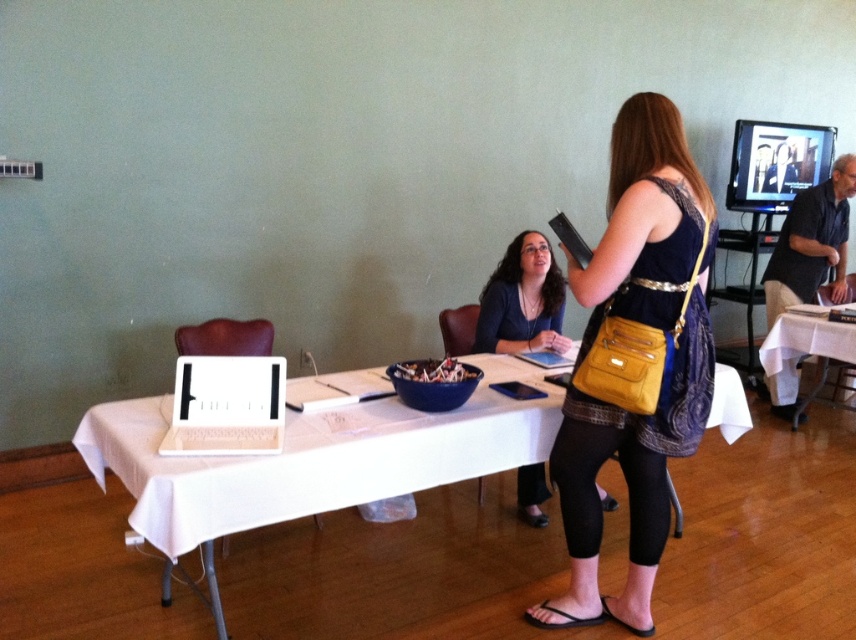
Is matte black shirt at center bigger than white cloth-covered table at right?

Actually, matte black shirt at center might be smaller than white cloth-covered table at right.

Does point (527, 477) come closer to viewer compared to point (848, 348)?

Yes, it is in front of point (848, 348).

Where is `matte black shirt at center`? This screenshot has width=856, height=640. matte black shirt at center is located at coordinates [522, 300].

Who is taller, matte black dress at center or matte black shirt at center?

With more height is matte black dress at center.

Does point (673, 317) lie in front of point (528, 481)?

Yes, point (673, 317) is in front of point (528, 481).

Does point (676, 452) come behind point (519, 492)?

No, it is in front of (519, 492).

Identify the location of matte black dress at center. (639, 360).

Does matte black dress at center have a greater height compared to white cloth-covered table at right?

Correct, matte black dress at center is much taller as white cloth-covered table at right.

Can you confirm if matte black dress at center is shorter than white cloth-covered table at right?

Incorrect, matte black dress at center's height does not fall short of white cloth-covered table at right's.

Find the location of a particular element. The image size is (856, 640). matte black dress at center is located at coordinates (639, 360).